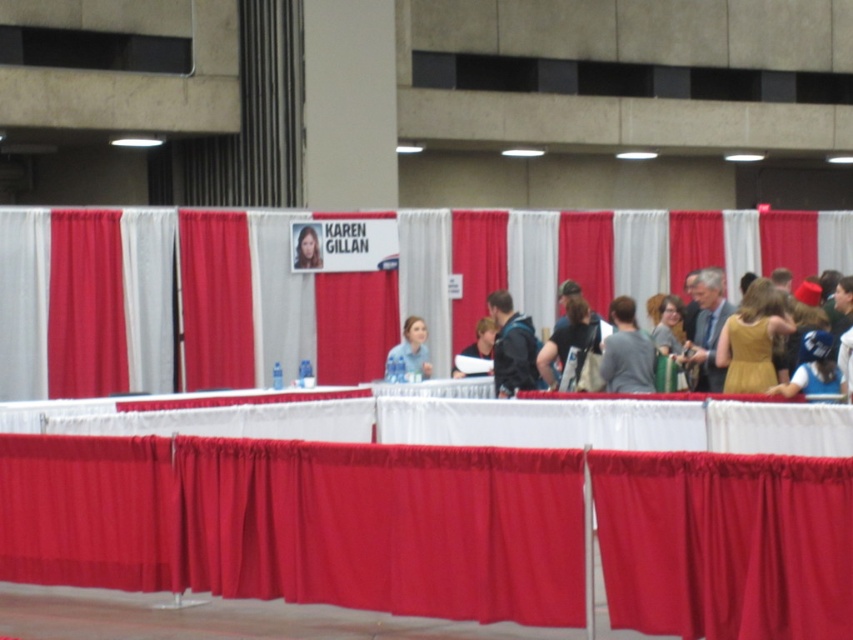
You are attending a fan event and want to take a photo with Karen Gillan. You notice the golden satin dress at right and the blue fabric at center. Which object is located to the right of the other?

The golden satin dress at right is positioned on the right side of blue fabric at center.

You are a photographer at the event and need to adjust the camera angle to focus on the blue fabric at center and the matte black jacket at center. Which object should you move closer to the camera to make it appear larger in the frame?

The blue fabric at center is in front of the matte black jacket at center. To make the blue fabric at center appear larger in the frame, you should move it closer to the camera. Alternatively, moving the matte black jacket at center away from the camera would also achieve this effect.

You are a photographer standing at the event venue. You want to capture a photo of the red fabric curtain at center without including any of the people around the tables. Given that the camera you are using has a focal length of 50mm and a sensor size of 24mm x 36mm, can you estimate whether the curtain is far enough to avoid people in the frame?

The red fabric curtain at center is 18.22 meters away from the camera. With a 50mm focal length and a sensor size of 24mm x 36mm, the field of view would be approximately 46 degrees horizontally. At 18.22 meters, the horizontal coverage would be about 13.8 meters. Since the tables and people are positioned between the camera and the curtain, the distance is sufficient to ensure the curtain is framed without including the nearby people.